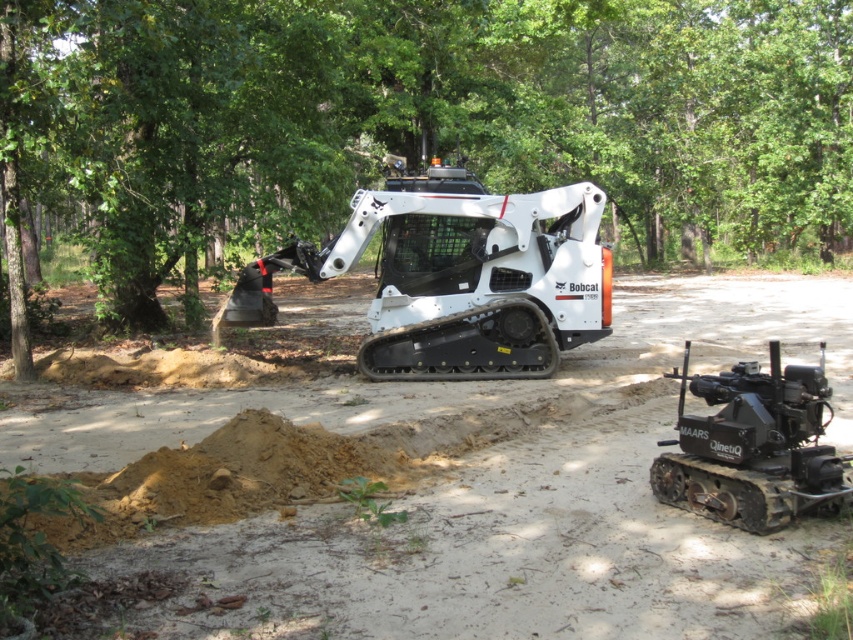
You are standing at the point marked by the coordinates (421, 120) in the image. Looking around, you see a Bobcat excavator in the foreground and a MAARS QinetiQ vehicle to its right. What is the closest object to your current position?

The closest object to your current position at point (421, 120) is the green leafy tree at upper center, as the coordinates correspond to its location.

You are a landscape architect designing a new park. You need to place a new bench between the green leafy tree at upper center and the black rubber tracked vehicle at lower right. Considering their widths, which object will require more space for the bench placement?

The green leafy tree at upper center requires more space for bench placement since its width surpasses that of the black rubber tracked vehicle at lower right.

You are a construction worker standing at the point marked by the coordinates (492, 490). Looking around, you see the Bobcat excavator and the MAARS QinetiQ vehicle. Which direction should you walk to reach the Bobcat excavator first?

Answer: The point marked by the coordinates (492, 490) is located at the center of the brown sandy soil. Since the Bobcat excavator is in the foreground and the MAARS QinetiQ vehicle is to its right, walking towards the Bobcat excavator would require moving towards the foreground area where it is positioned, while the MAARS QinetiQ is to the right. However, the exact direction depends on the layout. Since the Bobcat is in the foreground, moving forward or slightly left from the marked point would lead to it first